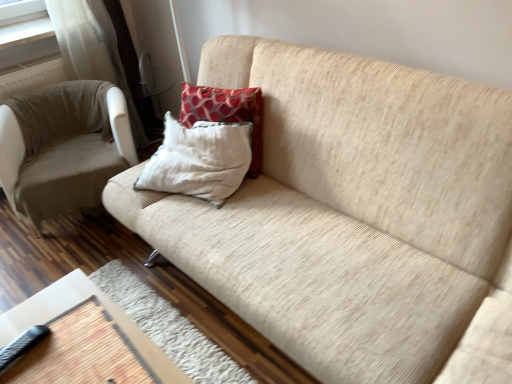
Question: Is beige fabric chair at left at the back of wooden table at lower left?

Choices:
 (A) yes
 (B) no

Answer: (B)

Question: Is wooden table at lower left far away from beige fabric chair at left?

Choices:
 (A) yes
 (B) no

Answer: (B)

Question: Is wooden table at lower left thinner than beige fabric chair at left?

Choices:
 (A) yes
 (B) no

Answer: (B)

Question: From the image's perspective, is wooden table at lower left on top of beige fabric chair at left?

Choices:
 (A) no
 (B) yes

Answer: (A)

Question: Is beige fabric chair at left completely or partially inside wooden table at lower left?

Choices:
 (A) yes
 (B) no

Answer: (B)

Question: Is beige fabric chair at left inside or outside of black rubberized remote at lower left?

Choices:
 (A) inside
 (B) outside

Answer: (B)

Question: Considering the relative positions of beige fabric chair at left and black rubberized remote at lower left in the image provided, is beige fabric chair at left to the left or to the right of black rubberized remote at lower left?

Choices:
 (A) left
 (B) right

Answer: (A)

Question: In the image, is beige fabric chair at left positioned in front of or behind black rubberized remote at lower left?

Choices:
 (A) front
 (B) behind

Answer: (B)

Question: Looking at the image, does beige fabric chair at left seem bigger or smaller compared to black rubberized remote at lower left?

Choices:
 (A) small
 (B) big

Answer: (B)

Question: Considering the relative positions of beige fabric chair at left and red textured pillow at center, acting as the 1th pillow starting from the front, in the image provided, is beige fabric chair at left to the left or to the right of red textured pillow at center, acting as the 1th pillow starting from the front,?

Choices:
 (A) right
 (B) left

Answer: (B)

Question: Based on their sizes in the image, would you say beige fabric chair at left is bigger or smaller than red textured pillow at center, acting as the 1th pillow starting from the front?

Choices:
 (A) small
 (B) big

Answer: (B)

Question: From their relative heights in the image, would you say beige fabric chair at left is taller or shorter than red textured pillow at center, acting as the 1th pillow starting from the front?

Choices:
 (A) tall
 (B) short

Answer: (A)

Question: Looking at their shapes, would you say beige fabric chair at left is wider or thinner than red textured pillow at center, the 2th pillow in the back-to-front sequence?

Choices:
 (A) thin
 (B) wide

Answer: (B)

Question: Is beige fabric couch at center in front of or behind beige fabric chair at left in the image?

Choices:
 (A) behind
 (B) front

Answer: (B)

Question: Is point (400, 94) closer or farther from the camera than point (94, 196)?

Choices:
 (A) farther
 (B) closer

Answer: (B)